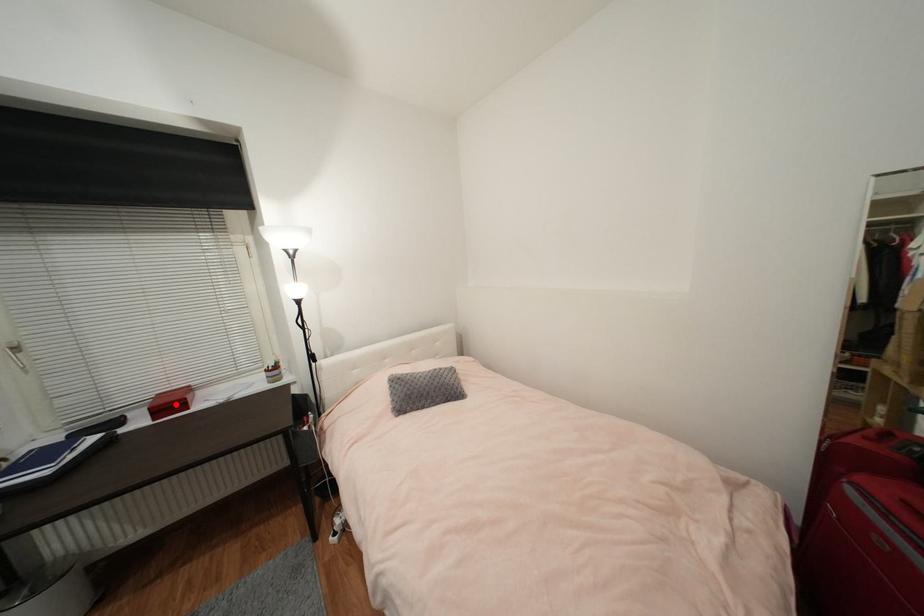
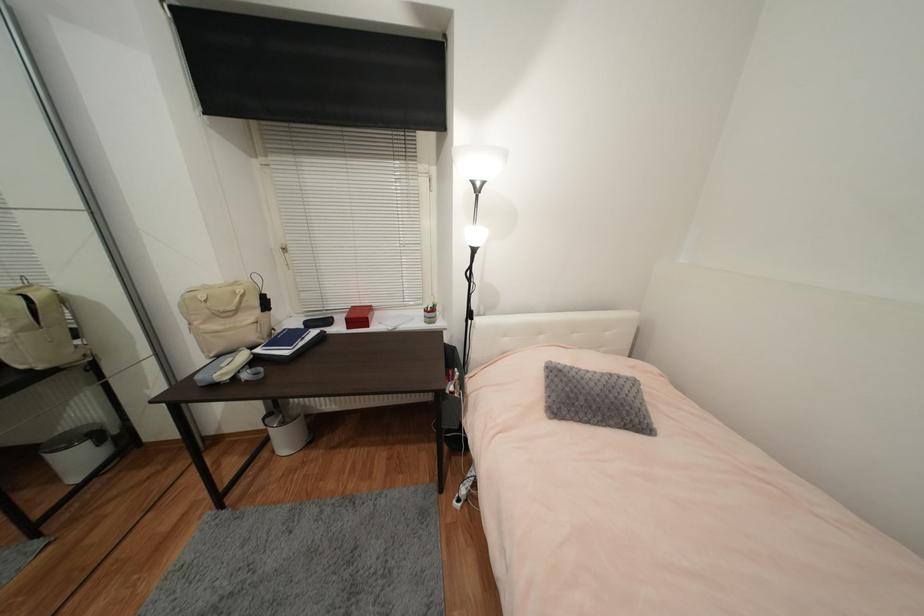
In the second image, find the point that corresponds to the highlighted location in the first image.

(363, 318)